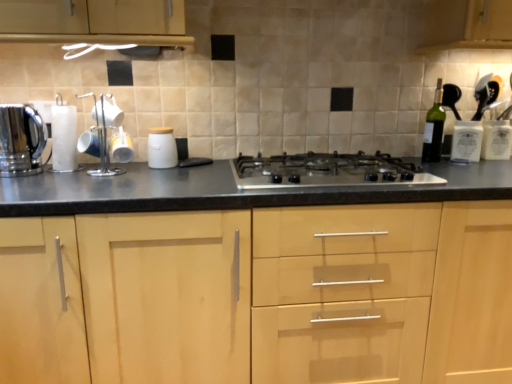
The image size is (512, 384). In order to click on vacant region in front of green glass bottle at right in this screenshot , I will do `click(434, 165)`.